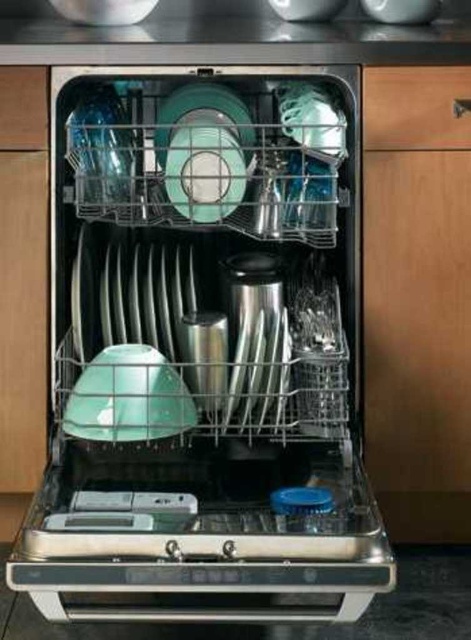
From the picture: You are organizing your kitchen and want to place a new spice jar. You have a small wooden drawer at right and a stainless steel dishwasher at center. Which location is better for storing the spice jar based on their positions?

The wooden drawer at right is better for storing the spice jar since it is above the stainless steel dishwasher at center, making it more accessible for storing frequently used items like spices.

You are standing in the kitchen and want to load a tall glass into the stainless steel dishwasher at center. Considering the space available, can you estimate if the glass, which is 1.2 meters tall, will fit inside the dishwasher?

The distance between you and the stainless steel dishwasher at center is 1.31 meters, but this measurement refers to the distance from the viewer to the dishwasher, not the dishwasher cavity height. Without knowing the actual height of the dishwasher cavity, it is impossible to determine if the 1.2 meter tall glass will fit.

You are standing in the kitchen and want to load the dishwasher. If you are 4 feet away from the stainless steel dishwasher at center, can you comfortably reach it to place a dish inside?

The stainless steel dishwasher at center is 4.29 feet away from the camera, so yes, you can comfortably reach it from 4 feet away to place a dish inside.